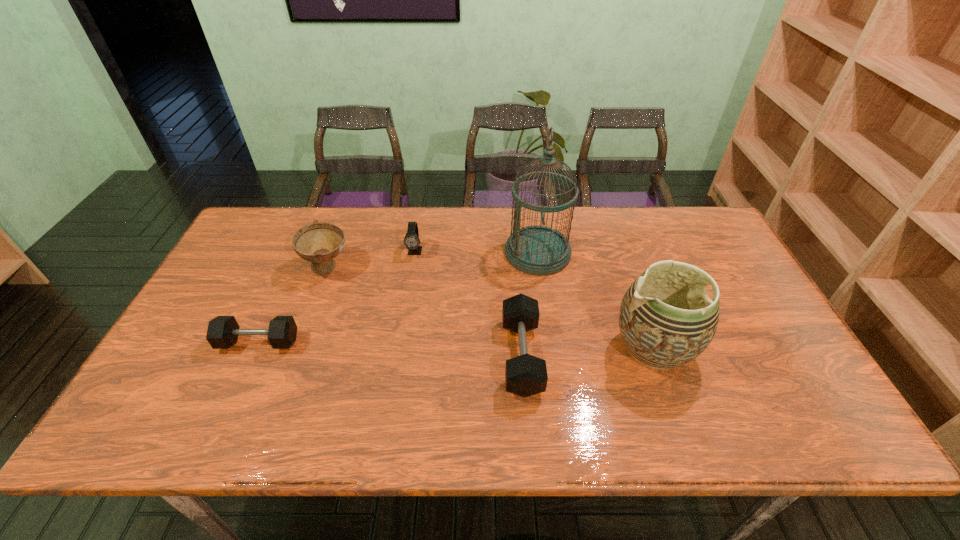
This screenshot has width=960, height=540. Identify the location of free location that satisfies the following two spatial constraints: 1. on the face of the pottery; 2. on the right side of the third object from left to right. coord(399,349).

The width and height of the screenshot is (960, 540). I want to click on free region that satisfies the following two spatial constraints: 1. on the face of the pottery; 2. on the right side of the third object from left to right, so click(399, 349).

You are a GUI agent. You are given a task and a screenshot of the screen. Output one action in this format:
    pyautogui.click(x=<x>, y=<y>)
    Task: Click on the free point that satisfies the following two spatial constraints: 1. on the back side of the rightmost object; 2. on the front-facing side of the tallest object
    This screenshot has width=960, height=540.
    Given the screenshot: What is the action you would take?
    pyautogui.click(x=620, y=253)

At what (x,y) coordinates should I click in order to perform the action: click on vacant region that satisfies the following two spatial constraints: 1. on the front side of the shorter dumbbell; 2. on the left side of the right dumbbell. Please return your answer as a coordinate pair (x, y). The image size is (960, 540). Looking at the image, I should click on (252, 356).